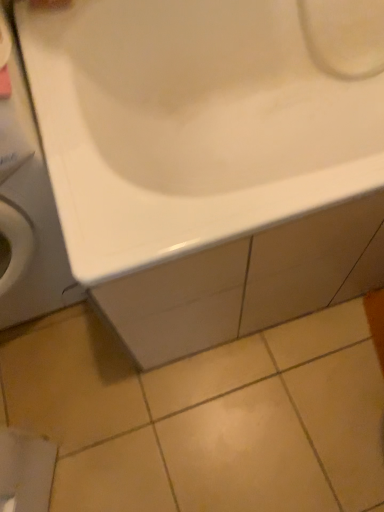
Where is `white glossy sink at center`? The width and height of the screenshot is (384, 512). white glossy sink at center is located at coordinates (x=201, y=120).

What do you see at coordinates (201, 120) in the screenshot? The height and width of the screenshot is (512, 384). I see `white glossy sink at center` at bounding box center [201, 120].

Where is `white glossy sink at center`? white glossy sink at center is located at coordinates (201, 120).